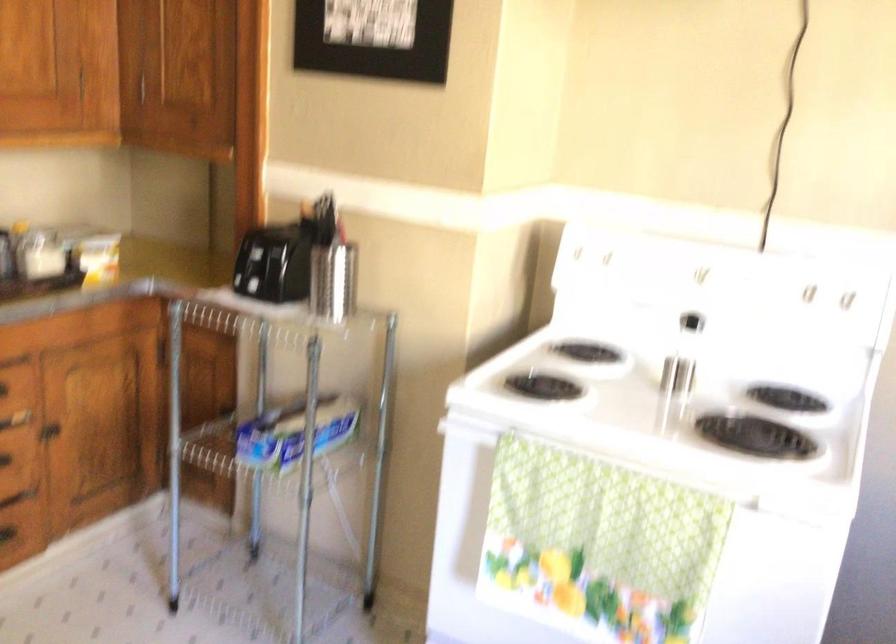
Where would you pull the drawer handle? Please return your answer as a coordinate pair (x, y).

(22, 493)